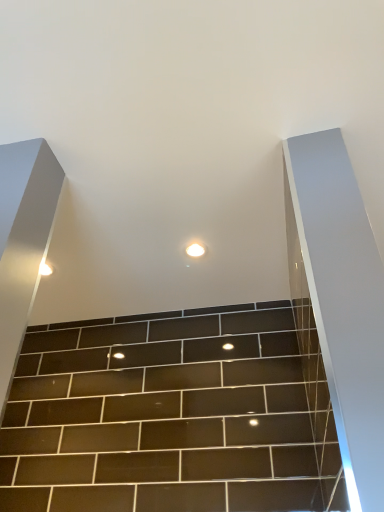
Image resolution: width=384 pixels, height=512 pixels. Describe the element at coordinates (196, 249) in the screenshot. I see `white glossy light at center` at that location.

Locate an element on the screen. The width and height of the screenshot is (384, 512). white glossy light at center is located at coordinates (196, 249).

The image size is (384, 512). Find the location of `white glossy light at center`. white glossy light at center is located at coordinates pyautogui.click(x=196, y=249).